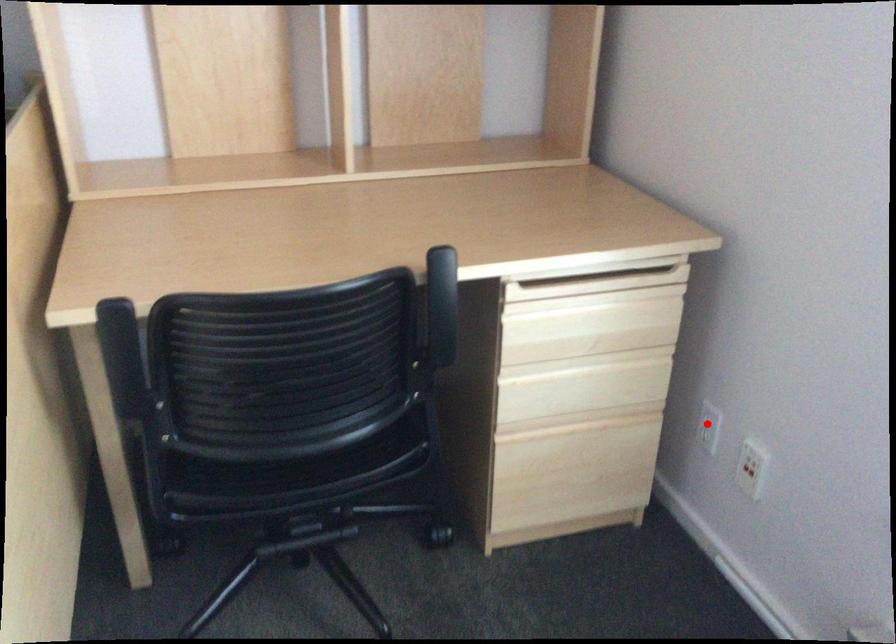
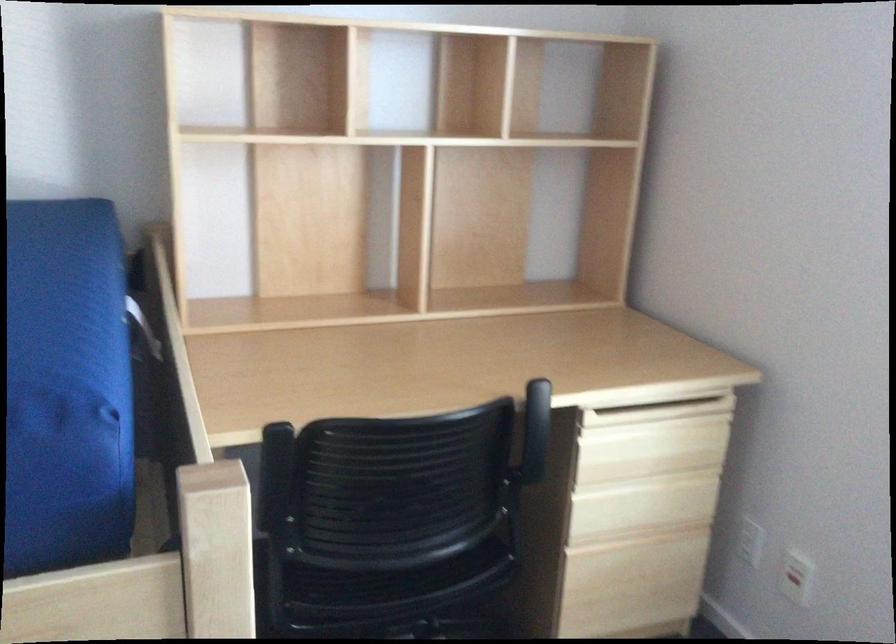
Find the pixel in the second image that matches the highlighted location in the first image.

(750, 541)